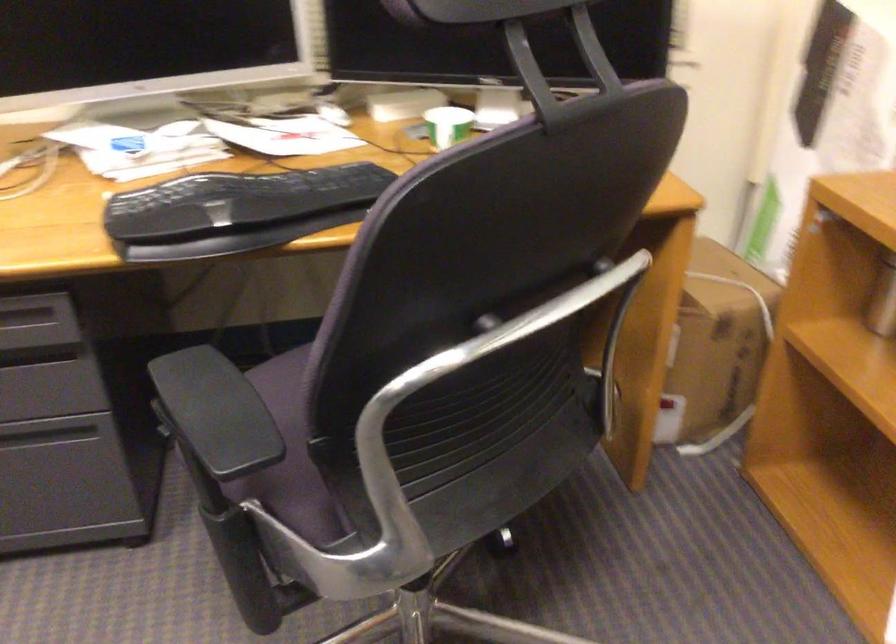
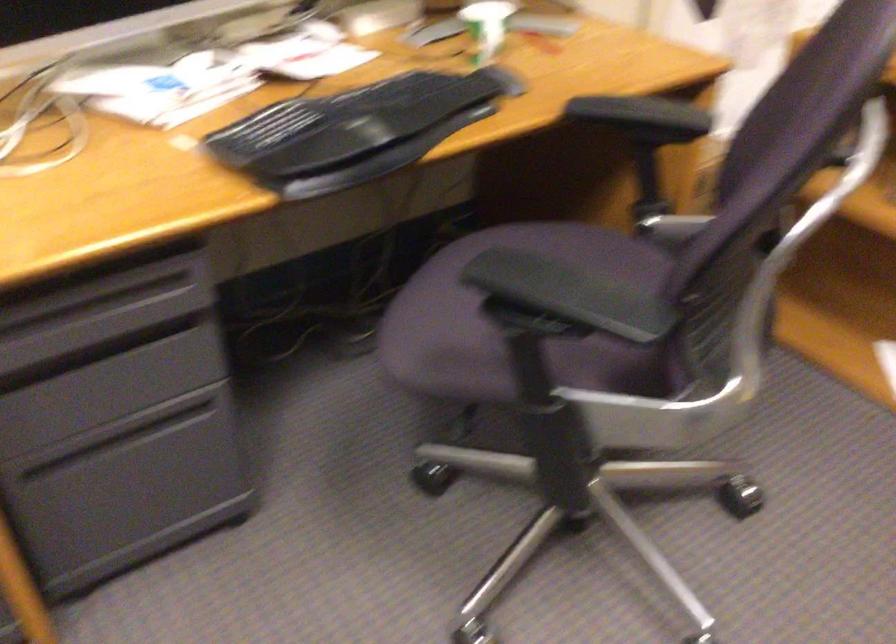
Where in the second image is the point corresponding to point (75, 488) from the first image?

(197, 471)